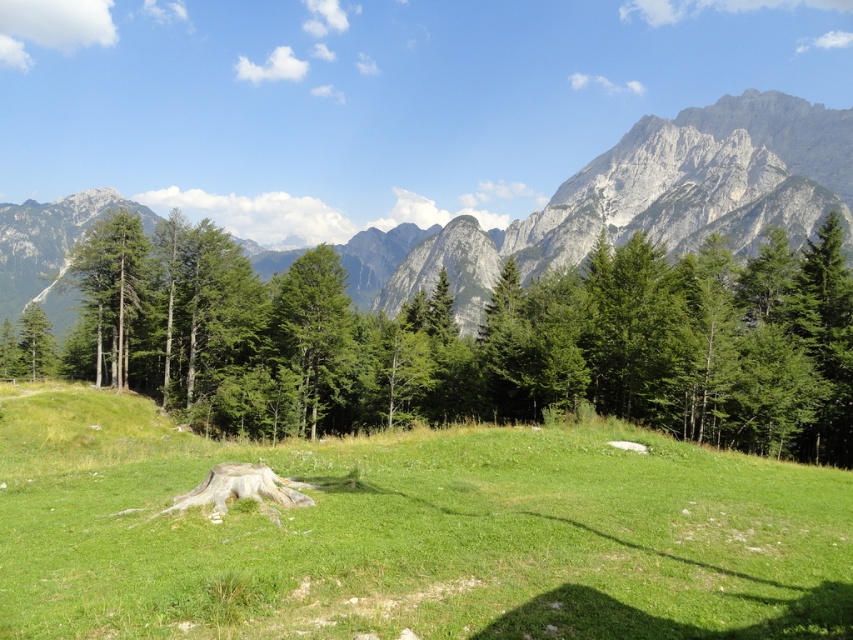
Locate an element on the screen. green leafy tree at center is located at coordinates (467, 340).

Measure the distance between green leafy tree at center and camera.

green leafy tree at center is 40.47 meters away from camera.

Image resolution: width=853 pixels, height=640 pixels. Find the location of `green leafy tree at center`. green leafy tree at center is located at coordinates (467, 340).

Can you confirm if green grassy field at center is positioned to the left of green leafy tree at center?

Yes, green grassy field at center is to the left of green leafy tree at center.

Between green grassy field at center and green leafy tree at center, which one appears on the right side from the viewer's perspective?

Positioned to the right is green leafy tree at center.

Does point (722, 605) lie in front of point (213, 266)?

That is True.

Locate an element on the screen. green grassy field at center is located at coordinates (409, 532).

Is green grassy field at center in front of green matte tree at left?

Yes, it is.

Is point (424, 428) positioned behind point (97, 268)?

No, it is in front of (97, 268).

Is point (364, 477) positioned before point (88, 236)?

Yes, point (364, 477) is closer to viewer.

Identify the location of green grassy field at center. The height and width of the screenshot is (640, 853). (409, 532).